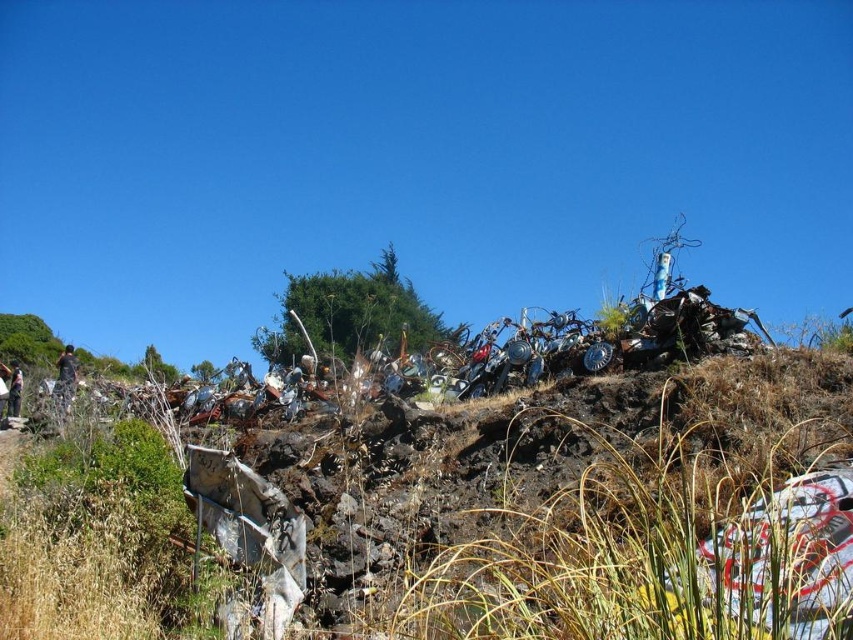
You are a hiker who has just arrived at this rugged outdoor scene. You notice the brown dry grass at lower left and the camouflage fabric jacket at left. Which object is closer to you as you stand in the scene?

The brown dry grass at lower left is closer to you because it is in front of the camouflage fabric jacket at left.

You are a photographer setting up equipment in the rugged outdoor scene. You notice the brown dry grass at lower left and the camouflage fabric shirt at lower left. Which object is wider from your viewpoint?

The brown dry grass at lower left is wider than the camouflage fabric shirt at lower left.